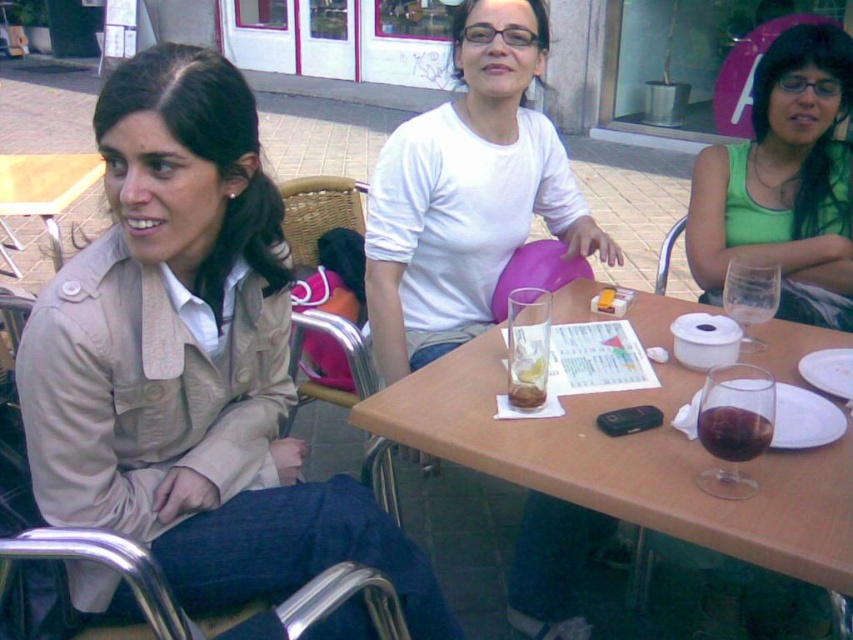
What are the coordinates of `white matte shirt at center` in the screenshot? It's located at (467, 193).

Does white matte shirt at center have a greater width compared to wooden table at center?

Incorrect, white matte shirt at center's width does not surpass wooden table at center's.

Between point (384, 324) and point (595, 396), which one is positioned behind?

Point (384, 324)

Find the location of a particular element. The image size is (853, 640). white matte shirt at center is located at coordinates pos(467,193).

Is point (171, 92) farther from camera compared to point (753, 451)?

Yes, it is.

Measure the distance between beige fabric jacket at left and dark red liquid at table center.

beige fabric jacket at left and dark red liquid at table center are 29.04 inches apart.

Who is more forward, (224,280) or (724,428)?

Positioned in front is point (724,428).

Locate an element on the screen. The image size is (853, 640). beige fabric jacket at left is located at coordinates (192, 362).

Is beige fabric jacket at left bigger than wooden table at center?

Actually, beige fabric jacket at left might be smaller than wooden table at center.

Does beige fabric jacket at left have a greater height compared to wooden table at center?

Correct, beige fabric jacket at left is much taller as wooden table at center.

Which is in front, point (129, 356) or point (602, 452)?

Point (129, 356)

Locate an element on the screen. Image resolution: width=853 pixels, height=640 pixels. beige fabric jacket at left is located at coordinates (192, 362).